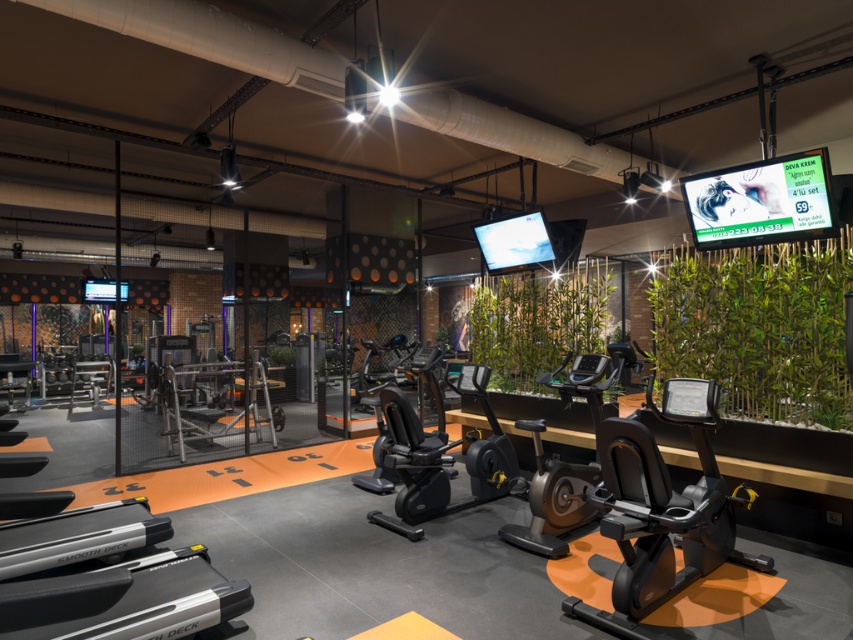
You are a gym member who wants to place a new plant between the green leafy plant at right and the green leafy plant at center. Which plant should the new plant be placed closer to if you want it to be shorter than both?

The new plant should be placed closer to the green leafy plant at center because it is shorter than the green leafy plant at right.

From the picture: You are a gym member who wants to place a new water bottle holder at the position of the green leafy plant at right. What are the coordinates of the point where you should place it?

The coordinates for the green leafy plant at right are at point (x=758, y=326).

You are a gym trainer who needs to set up a camera to monitor the green leafy plant at right. The camera has a minimum focus distance of 4 meters. Will the camera be able to clearly capture the plant?

The green leafy plant at right and the camera are 3.81 meters apart. Since the minimum focus distance is 4 meters, the camera cannot clearly capture the plant as it is too close.